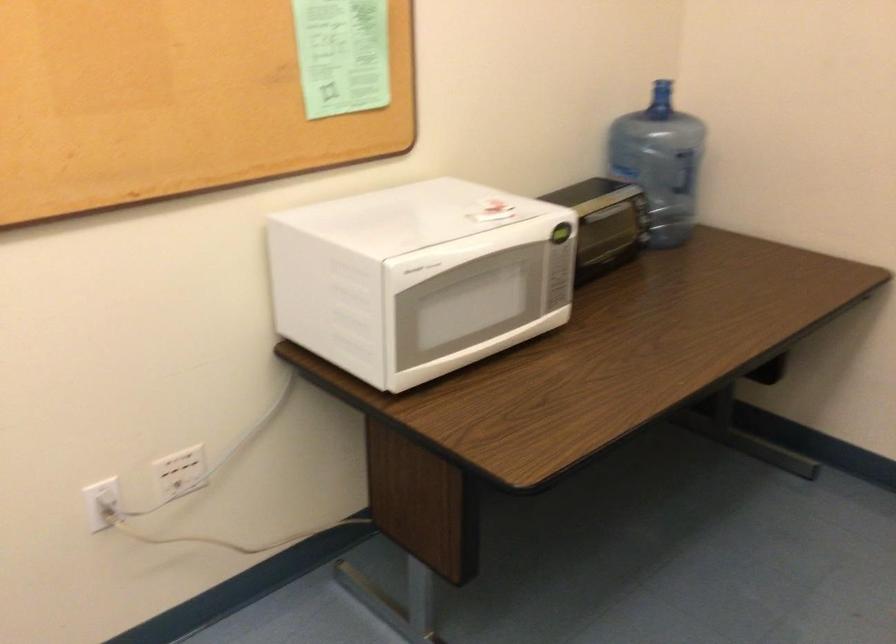
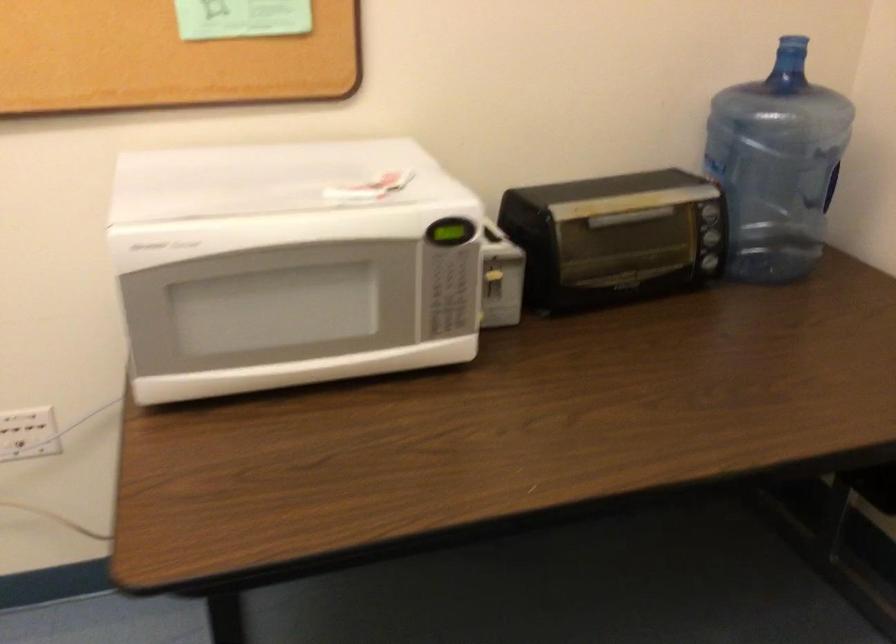
In a continuous first-person perspective shot, in which direction is the camera moving?

The cameraman walked toward right, forward.